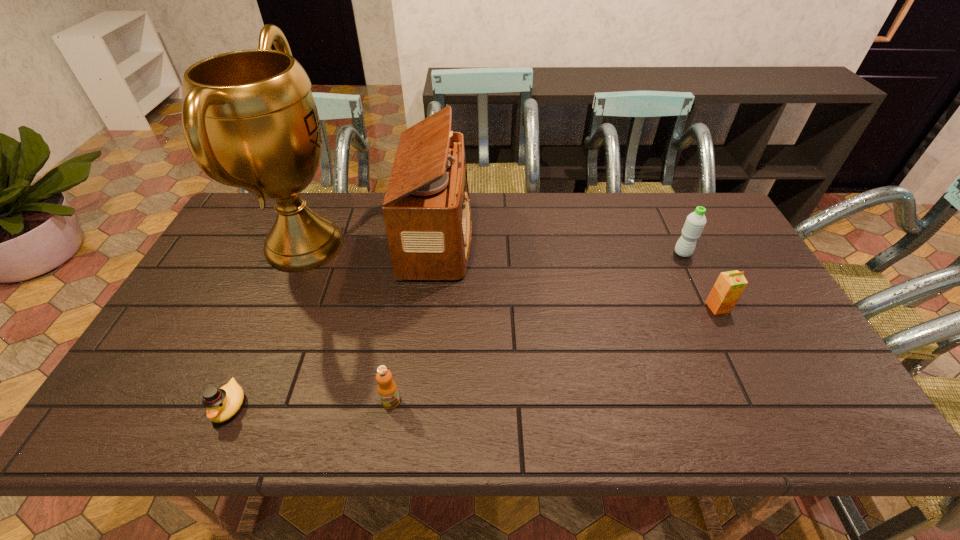
Identify the location of blank region between the duck and the tallest object. (267, 326).

What are the coordinates of `free space between the right orange juice and the water bottle` in the screenshot? It's located at (700, 280).

Identify the location of vacant area that lies between the tallest object and the water bottle. This screenshot has width=960, height=540. (493, 249).

Identify the location of object that is the second closest one to the water bottle. The image size is (960, 540). (426, 209).

Identify which object is located as the fifth nearest to the shortest object. Please provide its 2D coordinates. Your answer should be formatted as a tuple, i.e. [(x, y)], where the tuple contains the x and y coordinates of a point satisfying the conditions above.

[(695, 222)]

Identify the location of vacant space that satisfies the following two spatial constraints: 1. on the surface of the trophy cup with symbols; 2. on the back side of the right orange juice. (278, 307).

Image resolution: width=960 pixels, height=540 pixels. Find the location of `vacant space that satisfies the following two spatial constraints: 1. on the surface of the right orange juice with symbols; 2. on the left side of the trophy cup`. vacant space that satisfies the following two spatial constraints: 1. on the surface of the right orange juice with symbols; 2. on the left side of the trophy cup is located at coordinates (278, 307).

Locate an element on the screen. Image resolution: width=960 pixels, height=540 pixels. vacant space that satisfies the following two spatial constraints: 1. on the front panel of the radio receiver; 2. on the front label of the left orange juice is located at coordinates (420, 402).

The height and width of the screenshot is (540, 960). What are the coordinates of `vacant region that satisfies the following two spatial constraints: 1. on the back side of the fourth shortest object; 2. on the surface of the trophy cup with symbols` in the screenshot? It's located at (679, 246).

Where is `free space that satisfies the following two spatial constraints: 1. on the front panel of the farther orange juice; 2. on the right side of the radio receiver`? The image size is (960, 540). free space that satisfies the following two spatial constraints: 1. on the front panel of the farther orange juice; 2. on the right side of the radio receiver is located at coordinates (430, 307).